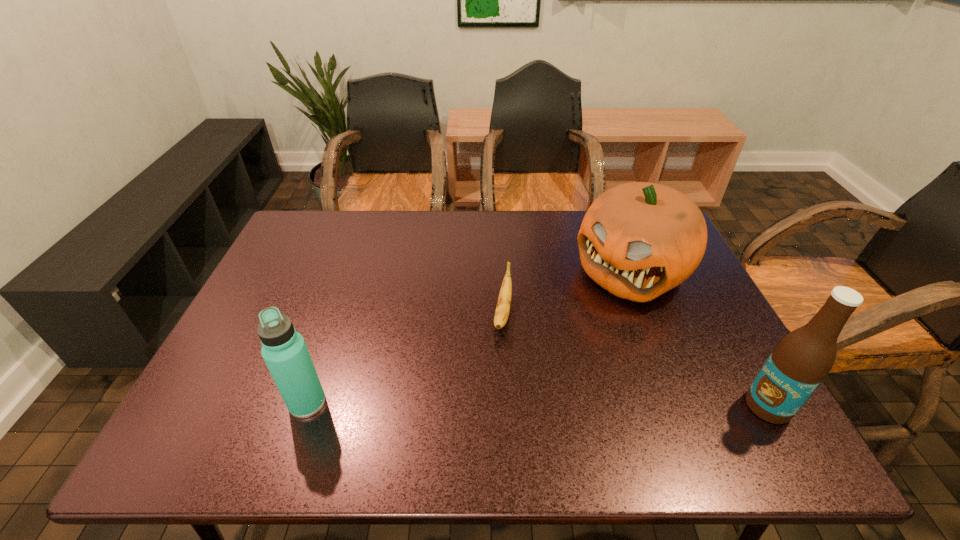
Find the location of a particular element. This screenshot has width=960, height=540. blank space located on the face of the pumpkin is located at coordinates (546, 351).

You are a GUI agent. You are given a task and a screenshot of the screen. Output one action in this format:
    pyautogui.click(x=<x>, y=<y>)
    Task: Click on the vacant position located on the face of the pumpkin
    The height and width of the screenshot is (540, 960).
    Given the screenshot: What is the action you would take?
    point(525,370)

Where is `free space located on the face of the pumpkin`? The height and width of the screenshot is (540, 960). free space located on the face of the pumpkin is located at coordinates [564, 335].

In order to click on object at the far edge in this screenshot , I will do `click(638, 240)`.

Locate an element on the screen. thermos bottle that is at the near edge is located at coordinates (284, 350).

The height and width of the screenshot is (540, 960). I want to click on beer bottle that is positioned at the near edge, so click(799, 363).

Find the location of a particular element. beer bottle at the right edge is located at coordinates click(799, 363).

Locate an element on the screen. This screenshot has height=540, width=960. pumpkin present at the right edge is located at coordinates (638, 240).

This screenshot has width=960, height=540. Find the location of `object situated at the far right corner`. object situated at the far right corner is located at coordinates (638, 240).

Locate an element on the screen. The image size is (960, 540). object at the near right corner is located at coordinates pyautogui.click(x=799, y=363).